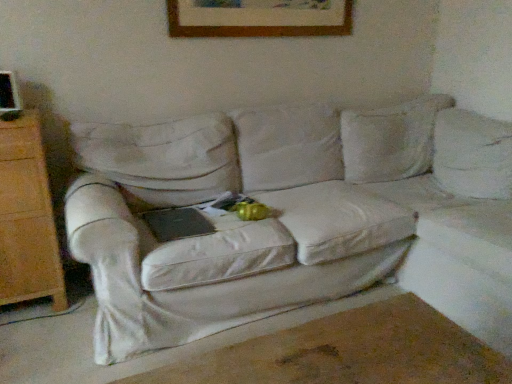
In order to face white fabric couch at center, should I rotate leftwards or rightwards?

To align with it, rotate right about 8.144°.

This screenshot has width=512, height=384. In order to click on white fabric couch at center in this screenshot , I will do `click(300, 220)`.

What do you see at coordinates (300, 220) in the screenshot?
I see `white fabric couch at center` at bounding box center [300, 220].

Consider the image. What is the approximate width of white fabric couch at center?

white fabric couch at center is 34.00 inches wide.

What do you see at coordinates (257, 21) in the screenshot? I see `wooden picture frame at upper center` at bounding box center [257, 21].

Find the location of a particular element. wooden picture frame at upper center is located at coordinates (257, 21).

Where is `white fabric couch at center`? white fabric couch at center is located at coordinates (300, 220).

Is wooden picture frame at upper center to the left or to the right of white fabric couch at center in the image?

Based on their positions, wooden picture frame at upper center is located to the left of white fabric couch at center.

Does wooden picture frame at upper center come in front of white fabric couch at center?

No, wooden picture frame at upper center is further to the viewer.

Does point (219, 11) come farther from viewer compared to point (337, 165)?

No, (219, 11) is in front of (337, 165).

From the image's perspective, does wooden picture frame at upper center appear lower than white fabric couch at center?

No, from the image's perspective, wooden picture frame at upper center is not below white fabric couch at center.

From a real-world perspective, is wooden picture frame at upper center on white fabric couch at center?

Yes.

Which of these two, wooden picture frame at upper center or white fabric couch at center, is thinner?

With smaller width is wooden picture frame at upper center.

Does wooden picture frame at upper center have a lesser height compared to white fabric couch at center?

Yes, wooden picture frame at upper center is shorter than white fabric couch at center.

Considering the sizes of objects wooden picture frame at upper center and white fabric couch at center in the image provided, who is bigger, wooden picture frame at upper center or white fabric couch at center?

white fabric couch at center.

Which is correct: wooden picture frame at upper center is inside white fabric couch at center, or outside of it?

wooden picture frame at upper center is located beyond the bounds of white fabric couch at center.

Are wooden picture frame at upper center and white fabric couch at center located far from each other?

No, wooden picture frame at upper center is not far from white fabric couch at center.

Is wooden picture frame at upper center positioned with its back to white fabric couch at center?

That's not correct — wooden picture frame at upper center is not looking away from white fabric couch at center.

Identify the location of picture frame that appears above the white fabric couch at center (from the image's perspective). (257, 21).

Considering the positions of objects white fabric couch at center and wooden picture frame at upper center in the image provided, who is more to the left, white fabric couch at center or wooden picture frame at upper center?

wooden picture frame at upper center.

Relative to wooden picture frame at upper center, is white fabric couch at center in front or behind?

Clearly, white fabric couch at center is in front of wooden picture frame at upper center.

Does point (304, 207) come in front of point (195, 11)?

Yes, it is.

From the image's perspective, does white fabric couch at center appear higher than wooden picture frame at upper center?

No, from the image's perspective, white fabric couch at center is not above wooden picture frame at upper center.

From a real-world perspective, is white fabric couch at center located higher than wooden picture frame at upper center?

No, from a real-world perspective, white fabric couch at center is not over wooden picture frame at upper center

In terms of width, does white fabric couch at center look wider or thinner when compared to wooden picture frame at upper center?

Clearly, white fabric couch at center has more width compared to wooden picture frame at upper center.

Can you confirm if white fabric couch at center is taller than wooden picture frame at upper center?

Correct, white fabric couch at center is much taller as wooden picture frame at upper center.

Does white fabric couch at center have a larger size compared to wooden picture frame at upper center?

Yes, white fabric couch at center is bigger than wooden picture frame at upper center.

Is white fabric couch at center not within wooden picture frame at upper center?

Yes, white fabric couch at center is outside of wooden picture frame at upper center.

Are white fabric couch at center and wooden picture frame at upper center far apart?

No, white fabric couch at center is not far from wooden picture frame at upper center.

In the scene shown: Is white fabric couch at center oriented away from wooden picture frame at upper center?

No.

How different are the orientations of white fabric couch at center and wooden picture frame at upper center in degrees?

There is a 0.59-degree angle between the facing directions of white fabric couch at center and wooden picture frame at upper center.

Measure the distance between white fabric couch at center and wooden picture frame at upper center.

white fabric couch at center is 37.23 inches away from wooden picture frame at upper center.

You are a GUI agent. You are given a task and a screenshot of the screen. Output one action in this format:
    pyautogui.click(x=<x>, y=<y>)
    Task: Click on the studio couch that appears below the wooden picture frame at upper center (from the image's perspective)
    The image size is (512, 384).
    Given the screenshot: What is the action you would take?
    pyautogui.click(x=300, y=220)

This screenshot has height=384, width=512. In order to click on studio couch on the right of wooden picture frame at upper center in this screenshot , I will do `click(300, 220)`.

Identify the location of picture frame behind the white fabric couch at center. This screenshot has height=384, width=512. (257, 21).